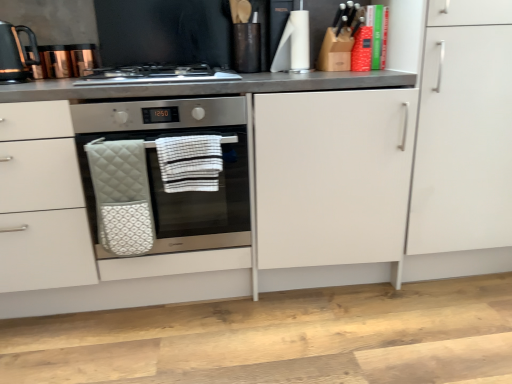
Question: Considering the positions of white striped fabric hand towel at center, arranged as the first hand towel when viewed from the right, and quilted white oven mitt at center, which is the 1th hand towel in left-to-right order, in the image, is white striped fabric hand towel at center, arranged as the first hand towel when viewed from the right, bigger or smaller than quilted white oven mitt at center, which is the 1th hand towel in left-to-right order,?

Choices:
 (A) small
 (B) big

Answer: (A)

Question: Considering the positions of point (194, 188) and point (153, 238), is point (194, 188) closer or farther from the camera than point (153, 238)?

Choices:
 (A) farther
 (B) closer

Answer: (B)

Question: Estimate the real-world distances between objects in this image. Which object is farther from the stainless steel gas stove at center?

Choices:
 (A) white matte cabinet at right
 (B) black glossy kettle at upper left
 (C) white striped fabric hand towel at center, placed as the 2th hand towel when sorted from left to right
 (D) satin silver oven at center
 (E) quilted white oven mitt at center, which is the 1th hand towel in left-to-right order

Answer: (A)

Question: Considering the real-world distances, which object is farthest from the white matte cabinet at right?

Choices:
 (A) white striped fabric hand towel at center, arranged as the first hand towel when viewed from the right
 (B) black glossy kettle at upper left
 (C) quilted white oven mitt at center, which is the 1th hand towel in left-to-right order
 (D) satin silver oven at center
 (E) stainless steel gas stove at center

Answer: (B)